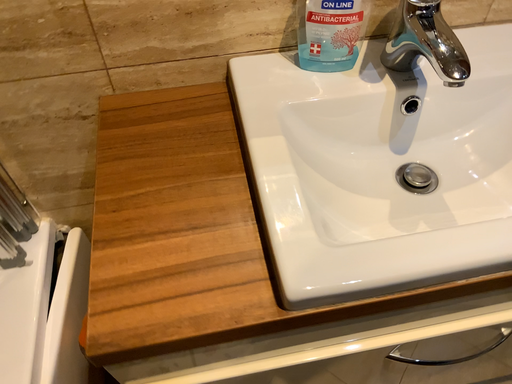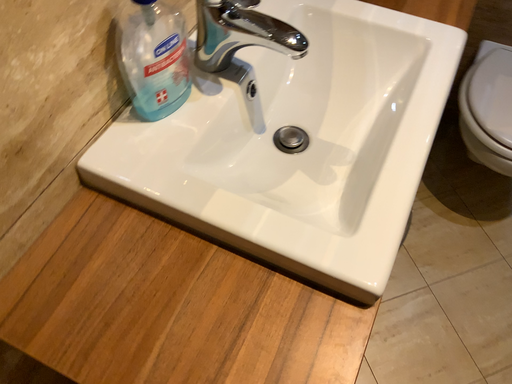
Question: Which way did the camera rotate in the video?

Choices:
 (A) rotated upward
 (B) rotated downward

Answer: (A)